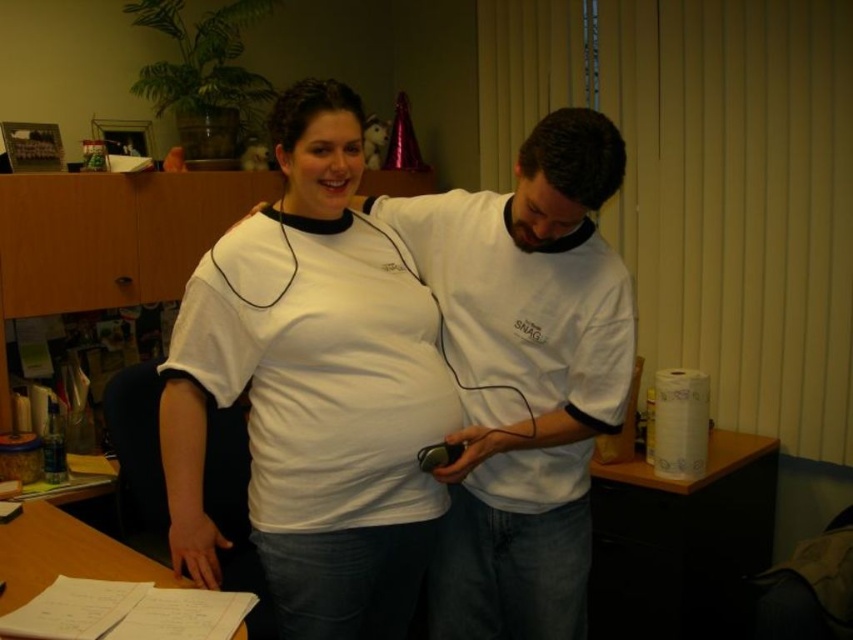
Question: Considering the relative positions of white paper towel at right and wooden desk at lower left in the image provided, where is white paper towel at right located with respect to wooden desk at lower left?

Choices:
 (A) above
 (B) below

Answer: (B)

Question: Does white matte shirt at center come in front of white paper towel at right?

Choices:
 (A) no
 (B) yes

Answer: (B)

Question: Which point is farther to the camera?

Choices:
 (A) (762, 440)
 (B) (106, 536)
 (C) (265, 492)

Answer: (A)

Question: Which of the following is the closest to the observer?

Choices:
 (A) (672, 612)
 (B) (341, 97)

Answer: (B)

Question: Does white paper towel at right appear over wooden desk at lower left?

Choices:
 (A) yes
 (B) no

Answer: (B)

Question: Which of the following is the closest to the observer?

Choices:
 (A) wooden desk at lower left
 (B) white matte shirt at center

Answer: (B)